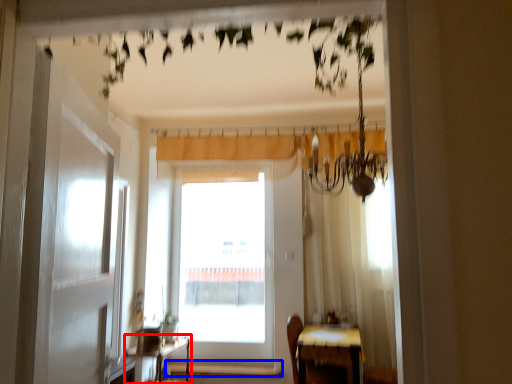
Question: Among these objects, which one is nearest to the camera, table (highlighted by a red box) or window sill (highlighted by a blue box)?

Choices:
 (A) table
 (B) window sill

Answer: (A)